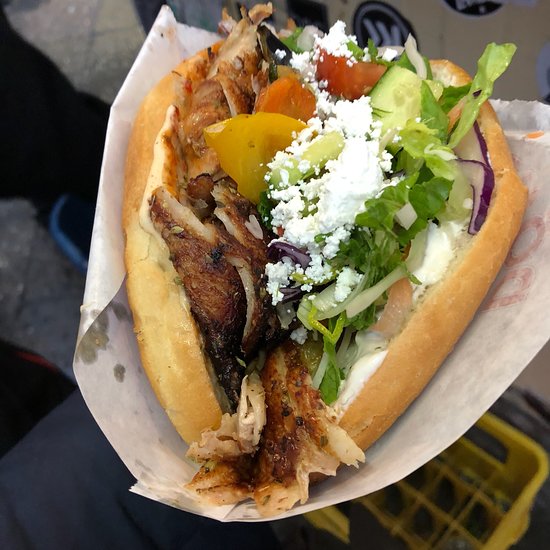
Identify the location of yellow basket. Image resolution: width=550 pixels, height=550 pixels. (432, 514).